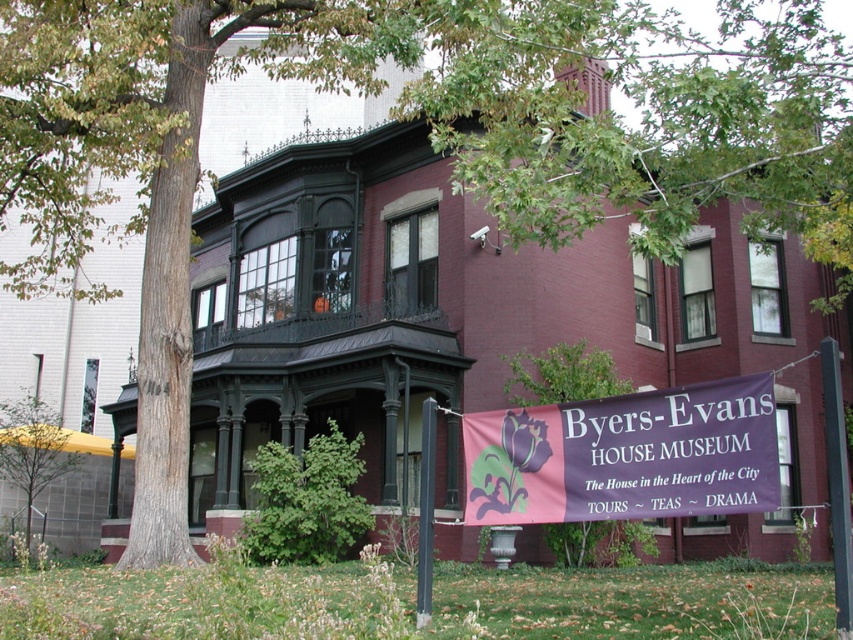
Who is lower down, green leafy tree at center or black wrought iron porch at upper center?

green leafy tree at center is below.

Which of these two, green leafy tree at center or black wrought iron porch at upper center, stands taller?

green leafy tree at center

Image resolution: width=853 pixels, height=640 pixels. I want to click on green leafy tree at center, so click(x=563, y=376).

Find the location of a particular element. green leafy tree at center is located at coordinates (563, 376).

Can you confirm if purple fabric banner at center is bigger than black wrought iron porch at upper center?

Incorrect, purple fabric banner at center is not larger than black wrought iron porch at upper center.

Looking at this image, is purple fabric banner at center to the left of black wrought iron porch at upper center from the viewer's perspective?

Incorrect, purple fabric banner at center is not on the left side of black wrought iron porch at upper center.

Who is more forward, [630,516] or [370,323]?

Point [630,516]

What are the coordinates of `purple fabric banner at center` in the screenshot? It's located at (625, 456).

Does green leafy tree at center have a lesser height compared to green leafy tree at lower left?

In fact, green leafy tree at center may be taller than green leafy tree at lower left.

Which is below, green leafy tree at center or green leafy tree at lower left?

green leafy tree at lower left is lower down.

Does point (593, 348) lie in front of point (4, 432)?

Yes, point (593, 348) is in front of point (4, 432).

Find the location of a particular element. green leafy tree at center is located at coordinates (563, 376).